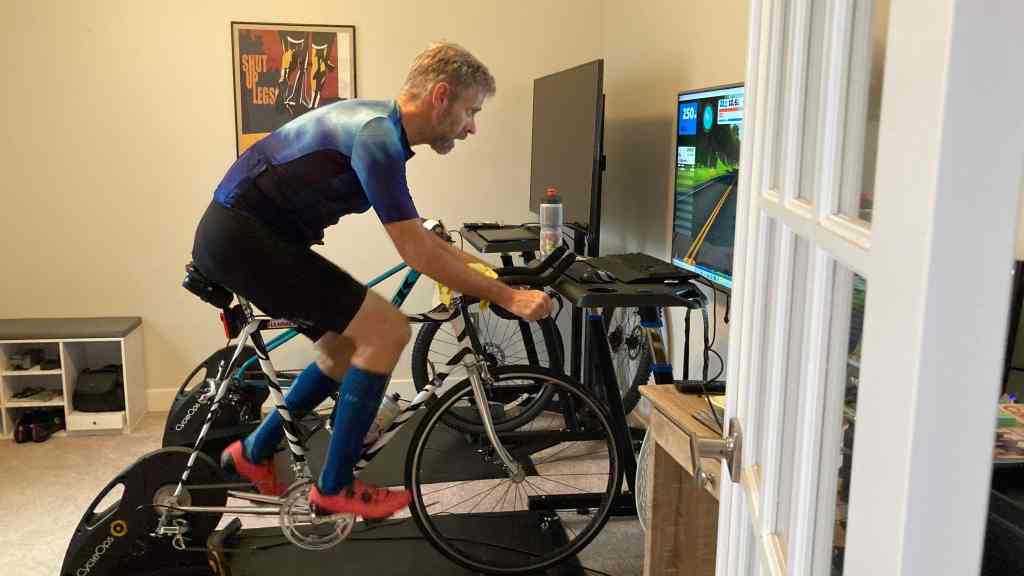
Locate an element on the screen. This screenshot has width=1024, height=576. wood table top is located at coordinates coord(679,413).